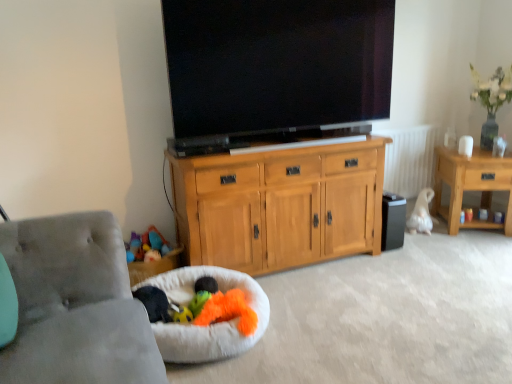
What are the coordinates of `vacant area that is situated to the right of light wood cabinet at center` in the screenshot? It's located at (401, 276).